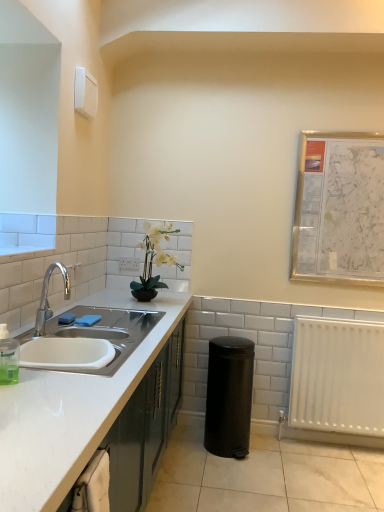
I want to click on free space in front of black matte trash can at lower right, so click(x=236, y=474).